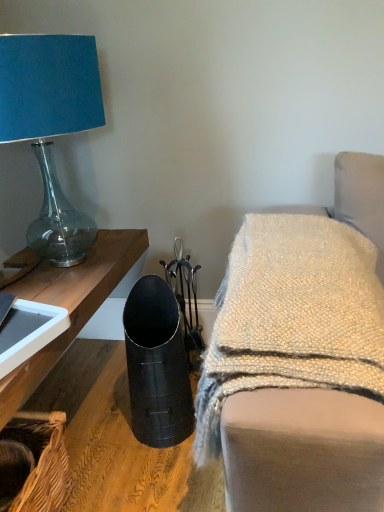
Question: From the image's perspective, is metallic black vase at lower left on woven brown basket at lower left?

Choices:
 (A) no
 (B) yes

Answer: (B)

Question: Is metallic black vase at lower left closer to camera compared to woven brown basket at lower left?

Choices:
 (A) no
 (B) yes

Answer: (B)

Question: Is metallic black vase at lower left thinner than woven brown basket at lower left?

Choices:
 (A) yes
 (B) no

Answer: (B)

Question: Considering the relative sizes of metallic black vase at lower left and woven brown basket at lower left in the image provided, is metallic black vase at lower left bigger than woven brown basket at lower left?

Choices:
 (A) no
 (B) yes

Answer: (B)

Question: Is metallic black vase at lower left wider than woven brown basket at lower left?

Choices:
 (A) no
 (B) yes

Answer: (B)

Question: Would you say matte blue fabric lampshade at upper left is inside or outside metallic black vase at lower left?

Choices:
 (A) outside
 (B) inside

Answer: (A)

Question: Relative to metallic black vase at lower left, is matte blue fabric lampshade at upper left in front or behind?

Choices:
 (A) behind
 (B) front

Answer: (A)

Question: From a real-world perspective, is matte blue fabric lampshade at upper left physically located above or below metallic black vase at lower left?

Choices:
 (A) below
 (B) above

Answer: (B)

Question: From the image's perspective, is matte blue fabric lampshade at upper left positioned above or below metallic black vase at lower left?

Choices:
 (A) above
 (B) below

Answer: (A)

Question: Would you say metallic black vase at lower left is to the left or to the right of matte blue fabric lampshade at upper left in the picture?

Choices:
 (A) right
 (B) left

Answer: (A)

Question: In terms of width, does metallic black vase at lower left look wider or thinner when compared to matte blue fabric lampshade at upper left?

Choices:
 (A) wide
 (B) thin

Answer: (A)

Question: From their relative heights in the image, would you say metallic black vase at lower left is taller or shorter than matte blue fabric lampshade at upper left?

Choices:
 (A) tall
 (B) short

Answer: (B)

Question: From the image's perspective, relative to matte blue fabric lampshade at upper left, is metallic black vase at lower left above or below?

Choices:
 (A) above
 (B) below

Answer: (B)

Question: In terms of width, does metallic black vase at lower left look wider or thinner when compared to woven brown basket at lower left?

Choices:
 (A) wide
 (B) thin

Answer: (A)

Question: Is metallic black vase at lower left situated inside woven brown basket at lower left or outside?

Choices:
 (A) outside
 (B) inside

Answer: (A)